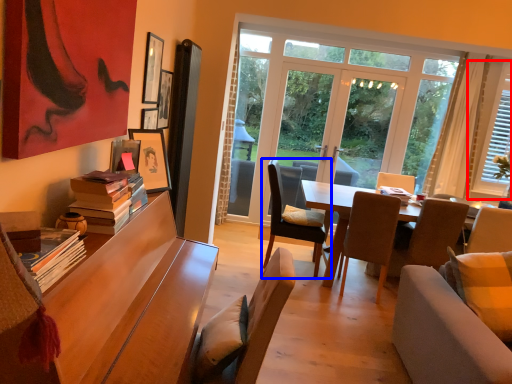
Question: Among these objects, which one is farthest to the camera, window (highlighted by a red box) or chair (highlighted by a blue box)?

Choices:
 (A) window
 (B) chair

Answer: (A)